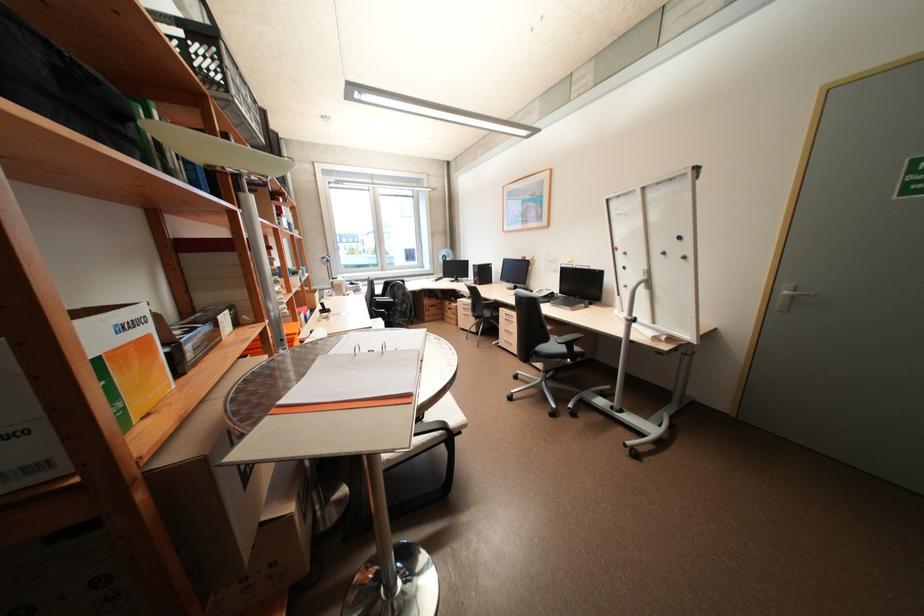
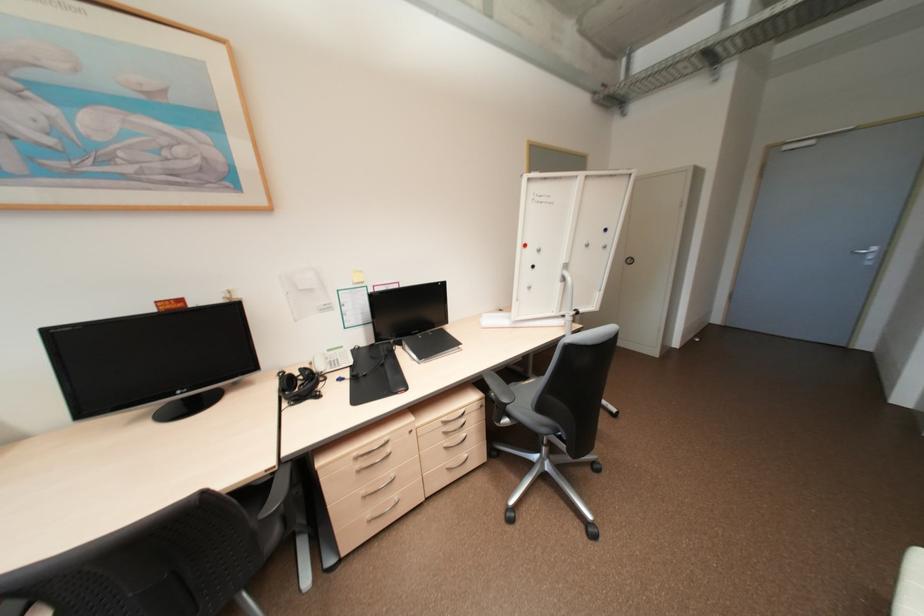
In the second image, find the point that corresponds to [629,267] in the first image.

(539, 265)